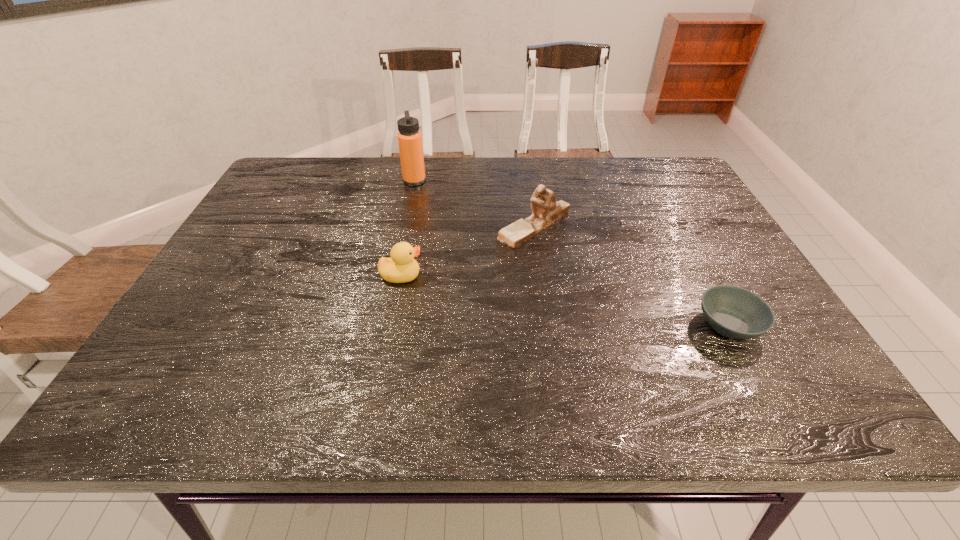
Image resolution: width=960 pixels, height=540 pixels. Identify the location of vacant area at the far left corner. (288, 167).

Identify the location of free space at the near left corner. (204, 412).

In order to click on free space between the tallest object and the rightmost object in this screenshot , I will do `click(571, 253)`.

This screenshot has height=540, width=960. I want to click on vacant space that's between the shortest object and the duck, so click(564, 300).

I want to click on vacant space that's between the thermos bottle and the shortest object, so click(x=571, y=253).

I want to click on unoccupied area between the duck and the shortest object, so pyautogui.click(x=564, y=300).

Find the location of a particular element. This screenshot has height=540, width=960. vacant area that lies between the third object from left to right and the farthest object is located at coordinates (474, 204).

Where is `unoccupied position between the third tallest object and the third nearest object`? Image resolution: width=960 pixels, height=540 pixels. unoccupied position between the third tallest object and the third nearest object is located at coordinates (468, 251).

Find the location of a particular element. The width and height of the screenshot is (960, 540). vacant point located between the nearest object and the farthest object is located at coordinates (571, 253).

Locate an element on the screen. free space between the duck and the thermos bottle is located at coordinates (408, 228).